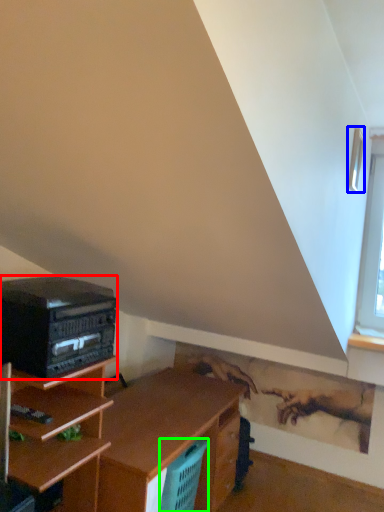
Question: Which object is the closest to the stereo (highlighted by a red box)? Choose among these: window (highlighted by a blue box) or basket (highlighted by a green box).

Choices:
 (A) window
 (B) basket

Answer: (B)